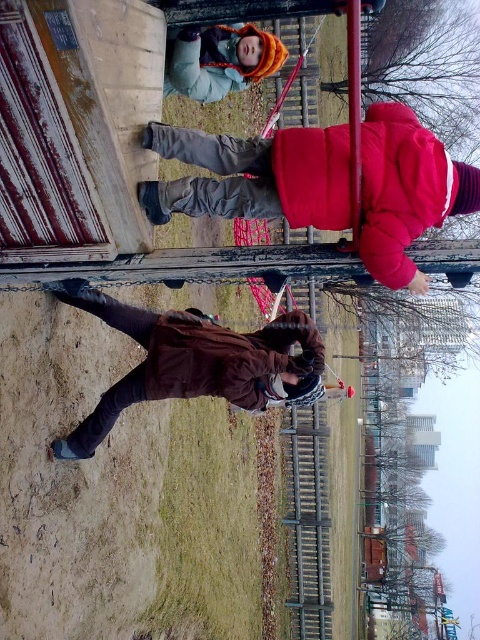
You are standing at the edge of the playground and see the brown matte jacket at lower center and the metallic chain at upper center. Which object is closer to your left side?

The brown matte jacket at lower center is closer to your left side because it is positioned to the left of the metallic chain at upper center.

You are a parent at the playground and want to ensure the children are safe. You notice the matte red jacket at upper right and the metallic chain at upper center. Which object is narrower in width?

The matte red jacket at upper right is narrower in width than the metallic chain at upper center.

You are planning to place a new bench in the playground so that it can be equidistant from both the brown matte jacket at center and the orange knit hat at upper center. What is the minimum distance the bench should be placed from each object to achieve this?

The bench should be placed exactly halfway between the brown matte jacket at center and the orange knit hat at upper center, which are 7.59 meters apart. This means the minimum distance from each object would be 3.795 meters.